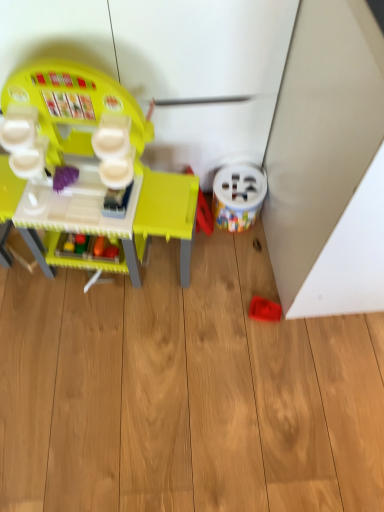
The width and height of the screenshot is (384, 512). What are the coordinates of `vacant area that lies in front of rubberized red toy at lower right, the 3th toy from the left` in the screenshot? It's located at (270, 360).